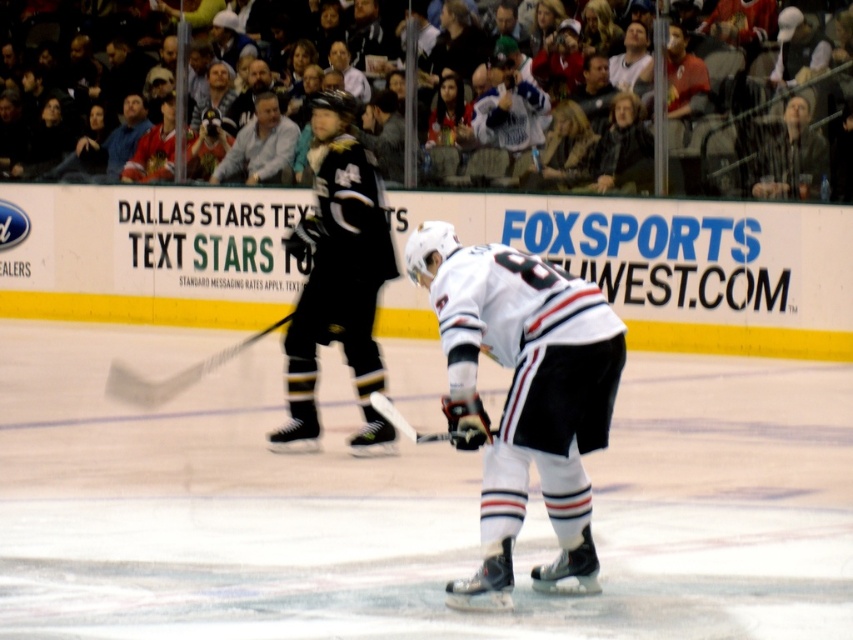
Question: Can you confirm if black matte jersey at center is positioned to the right of gray fabric shirt at upper center?

Choices:
 (A) no
 (B) yes

Answer: (B)

Question: Which point is closer to the camera taking this photo?

Choices:
 (A) (310, 147)
 (B) (508, 566)
 (C) (271, 116)

Answer: (B)

Question: Is black matte jersey at center closer to the viewer compared to gray fabric shirt at upper center?

Choices:
 (A) yes
 (B) no

Answer: (A)

Question: Which object is the farthest from the black matte jersey at center?

Choices:
 (A) white matte jersey at center
 (B) gray fabric shirt at upper center

Answer: (B)

Question: Which is nearer to the white matte jersey at center?

Choices:
 (A) black matte jersey at center
 (B) gray fabric shirt at upper center

Answer: (A)

Question: Can you confirm if black matte jersey at center is bigger than gray fabric shirt at upper center?

Choices:
 (A) yes
 (B) no

Answer: (A)